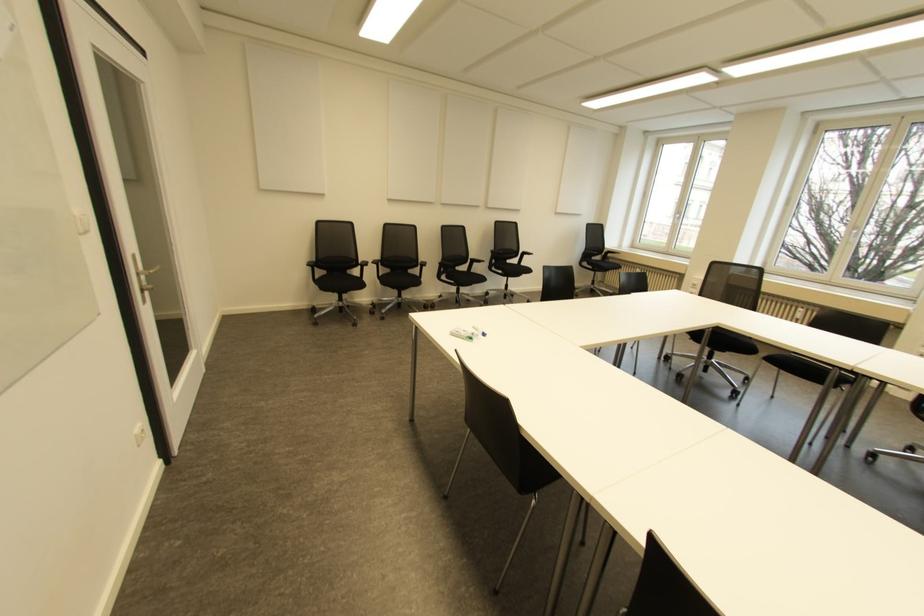
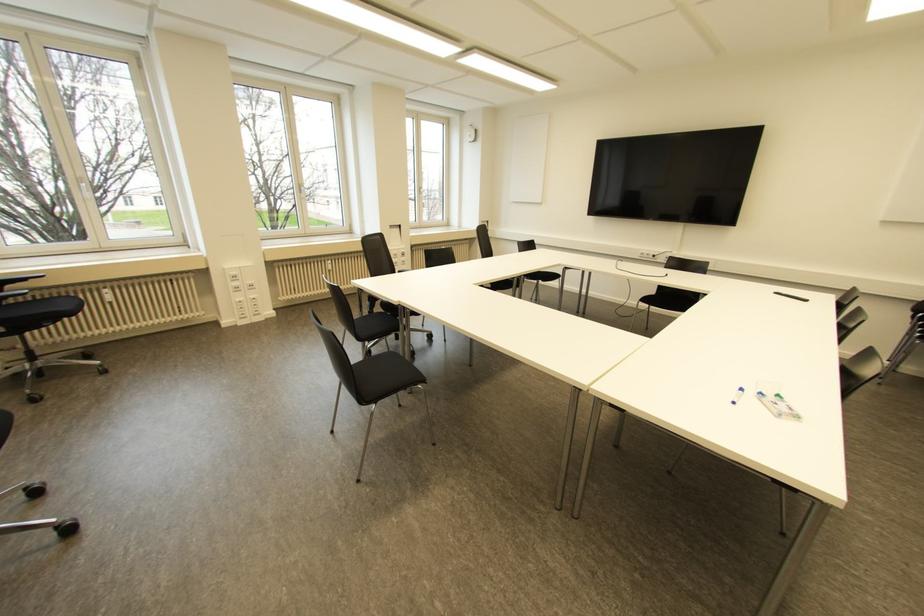
The point at (483, 334) is marked in the first image. Where is the corresponding point in the second image?

(739, 390)